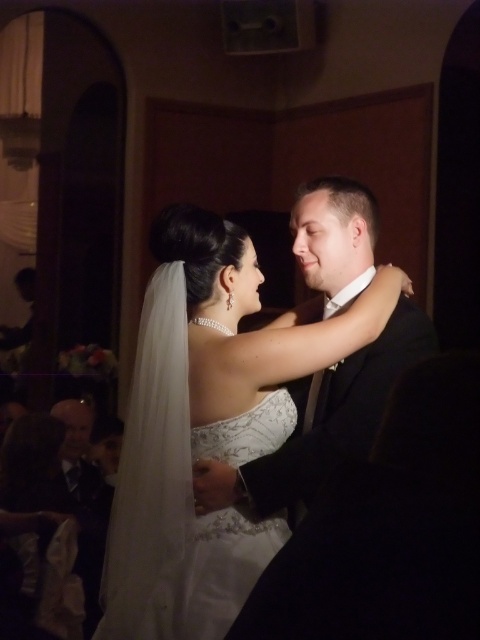
You are a photographer at a wedding reception and need to position two dresses in the center of the frame for a photo. The dresses are the white satin dress at center and the white lace dress at center. Which dress requires more space horizontally to avoid overlapping with other objects?

The white satin dress at center requires more horizontal space because its width is larger than the white lace dress at center.

You are a photographer at a wedding reception. You notice two dresses at the center of the image. Which dress is positioned higher between the white satin dress at center and the white lace dress at center?

The white satin dress at center is positioned higher than the white lace dress at center according to the description.